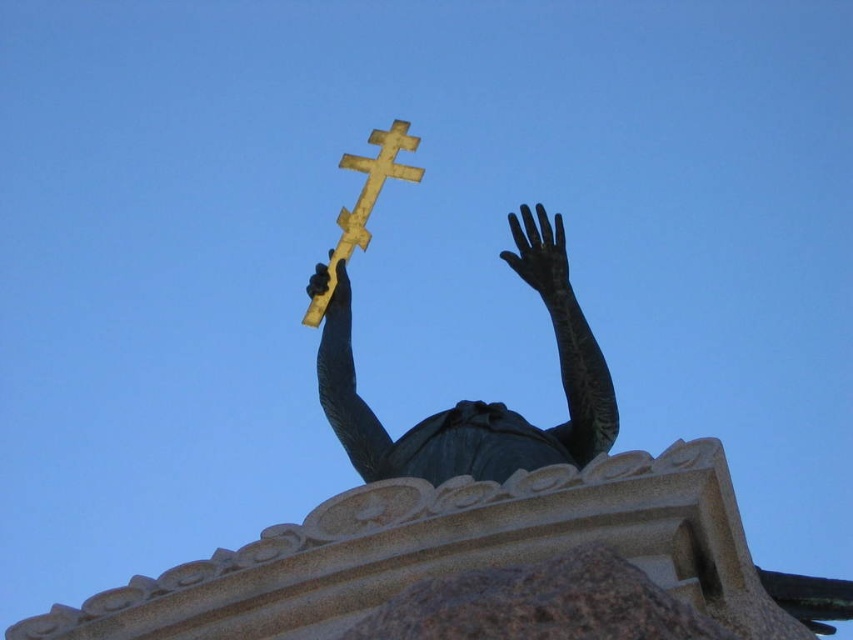
Which is above, gold polished wood cross at upper center or black matte hand at upper center?

Positioned higher is gold polished wood cross at upper center.

Which is more to the right, gold polished wood cross at upper center or black matte hand at upper center?

black matte hand at upper center

Measure the distance between point (358, 211) and camera.

Point (358, 211) and camera are 127.64 meters apart.

In order to click on gold polished wood cross at upper center in this screenshot , I will do `click(364, 204)`.

Between bronze statue at center and gold polished wood cross at upper center, which one is positioned lower?

bronze statue at center is below.

Which is behind, point (567, 378) or point (354, 218)?

The point (354, 218) is more distant.

The height and width of the screenshot is (640, 853). I want to click on bronze statue at center, so click(x=480, y=401).

Does bronze statue at center have a lesser height compared to black matte hand at upper center?

No, bronze statue at center is not shorter than black matte hand at upper center.

Which is more to the left, bronze statue at center or black matte hand at upper center?

bronze statue at center

What do you see at coordinates (480, 401) in the screenshot? I see `bronze statue at center` at bounding box center [480, 401].

Image resolution: width=853 pixels, height=640 pixels. Identify the location of bronze statue at center. (480, 401).